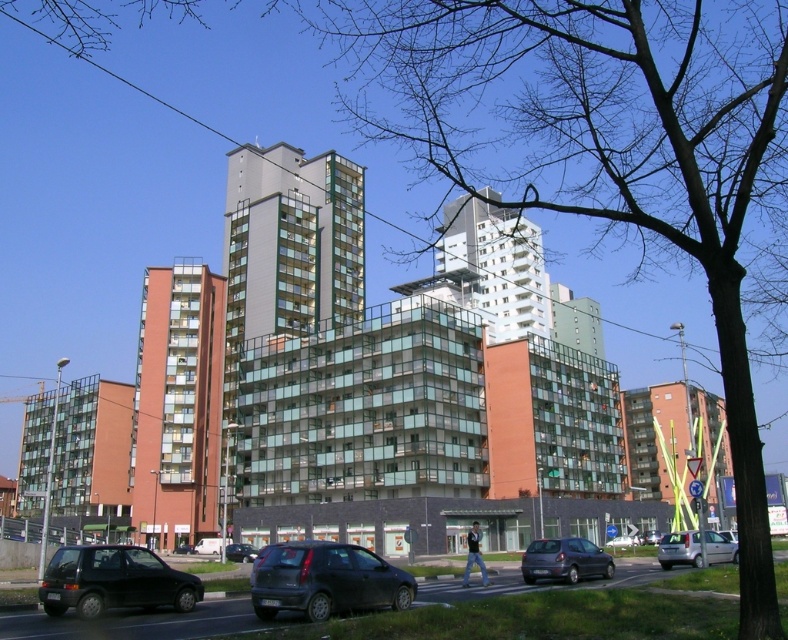
Question: Which object is positioned closest to the dark gray metallic hatchback at lower center?

Choices:
 (A) white matte van at lower left
 (B) matte black car at center

Answer: (B)

Question: Which of the following is the farthest from the observer?

Choices:
 (A) (597, 572)
 (B) (701, 560)
 (C) (199, 538)
 (D) (128, 605)

Answer: (C)

Question: Does matte black car at lower left appear on the right side of dark gray metallic hatchback at lower center?

Choices:
 (A) yes
 (B) no

Answer: (B)

Question: Is matte orange building at center behind dark gray metallic hatchback at lower center?

Choices:
 (A) yes
 (B) no

Answer: (A)

Question: Which object appears closest to the camera in this image?

Choices:
 (A) white matte van at lower left
 (B) matte black car at lower left

Answer: (B)

Question: Is matte orange building at center to the left of dark gray matte hatchback at lower center from the viewer's perspective?

Choices:
 (A) yes
 (B) no

Answer: (A)